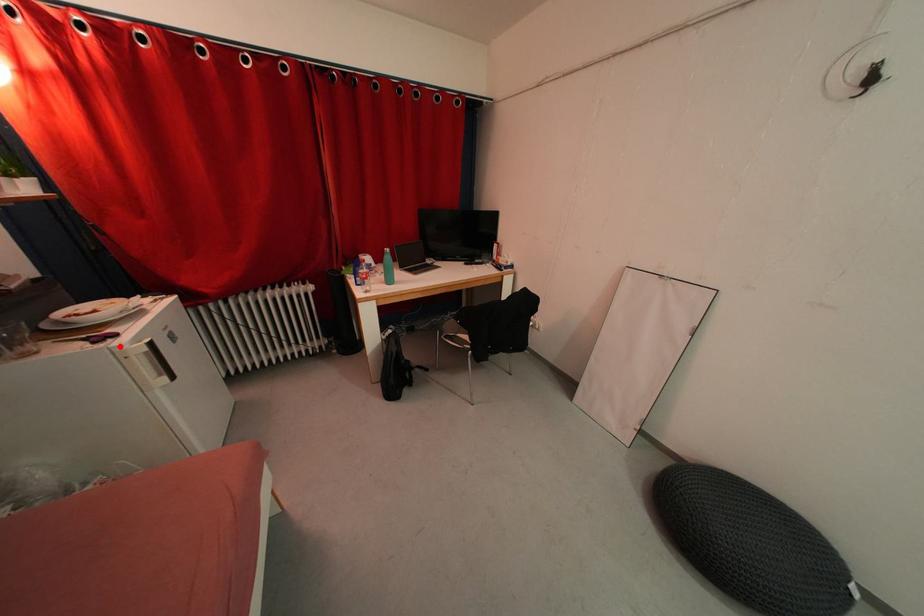
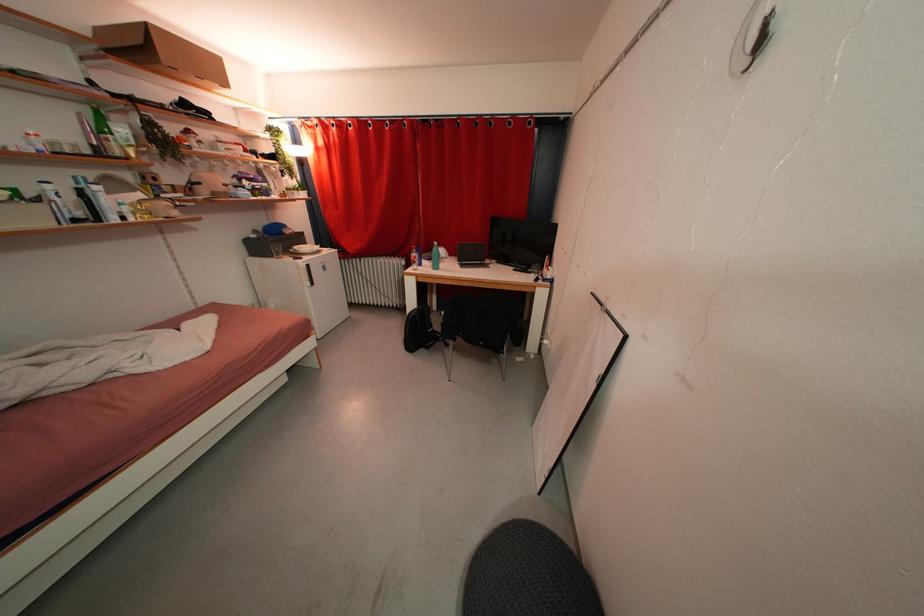
Find the pixel in the second image that matches the highlighted location in the first image.

(305, 265)